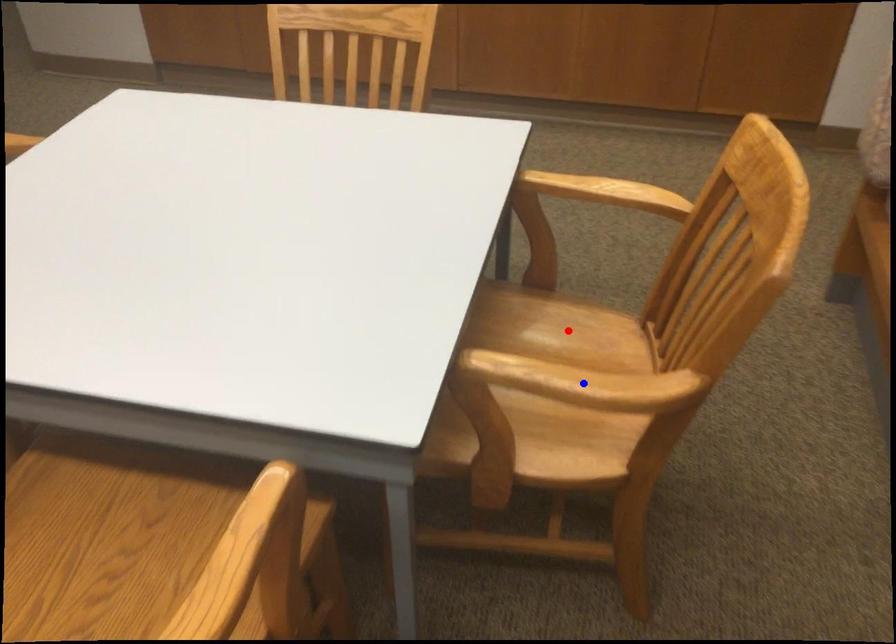
Question: Two points are marked on the image. Which point is closer to the camera?

Choices:
 (A) Blue point is closer.
 (B) Red point is closer.

Answer: (A)